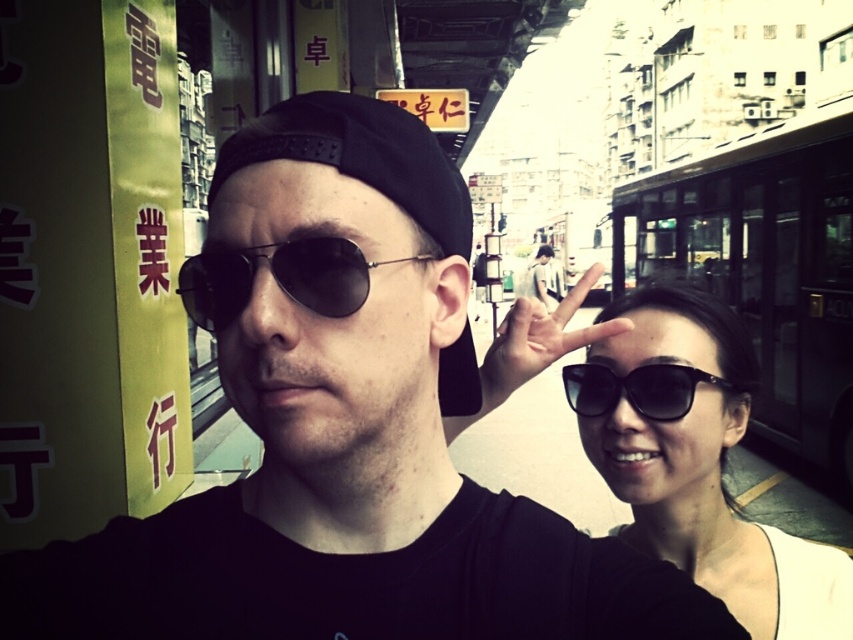
At what (x,y) coordinates should I click in order to perform the action: click on black matte sunglasses at upper right. Please return your answer as a coordinate pair (x, y). This screenshot has height=640, width=853. Looking at the image, I should click on (697, 460).

Which is above, black matte sunglasses at upper right or black matte sunglasses at right?

Positioned higher is black matte sunglasses at right.

Does point (643, 353) come behind point (660, 364)?

Yes.

The width and height of the screenshot is (853, 640). In order to click on black matte sunglasses at upper right in this screenshot , I will do `click(697, 460)`.

Who is lower down, black matte hand at center or black matte sunglasses at right?

black matte sunglasses at right is below.

Does black matte hand at center have a lesser height compared to black matte sunglasses at right?

In fact, black matte hand at center may be taller than black matte sunglasses at right.

Consider the image. Measure the distance between black matte hand at center and camera.

The distance of black matte hand at center from camera is 3.88 feet.

Image resolution: width=853 pixels, height=640 pixels. I want to click on black matte hand at center, so click(x=537, y=340).

Is black matte sunglasses at upper right below metallic round goggles at center?

Indeed, black matte sunglasses at upper right is positioned under metallic round goggles at center.

Is black matte sunglasses at upper right thinner than metallic round goggles at center?

Indeed, black matte sunglasses at upper right has a lesser width compared to metallic round goggles at center.

You are a GUI agent. You are given a task and a screenshot of the screen. Output one action in this format:
    pyautogui.click(x=<x>, y=<y>)
    Task: Click on the black matte sunglasses at upper right
    
    Given the screenshot: What is the action you would take?
    pyautogui.click(x=697, y=460)